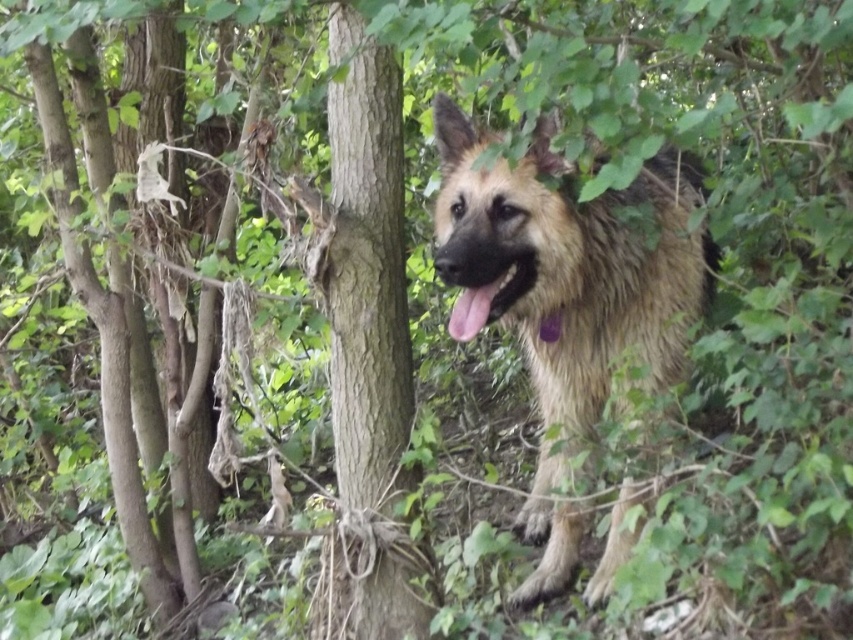
Question: Among these points, which one is farthest from the camera?

Choices:
 (A) pyautogui.click(x=509, y=301)
 (B) pyautogui.click(x=444, y=218)

Answer: (B)

Question: Is fuzzy brown dog at center thinner than black glossy tongue at center?

Choices:
 (A) yes
 (B) no

Answer: (B)

Question: Is fuzzy brown dog at center smaller than black glossy tongue at center?

Choices:
 (A) no
 (B) yes

Answer: (A)

Question: Can you confirm if fuzzy brown dog at center is positioned below black glossy tongue at center?

Choices:
 (A) no
 (B) yes

Answer: (B)

Question: Which point is closer to the camera?

Choices:
 (A) fuzzy brown dog at center
 (B) black glossy tongue at center

Answer: (A)